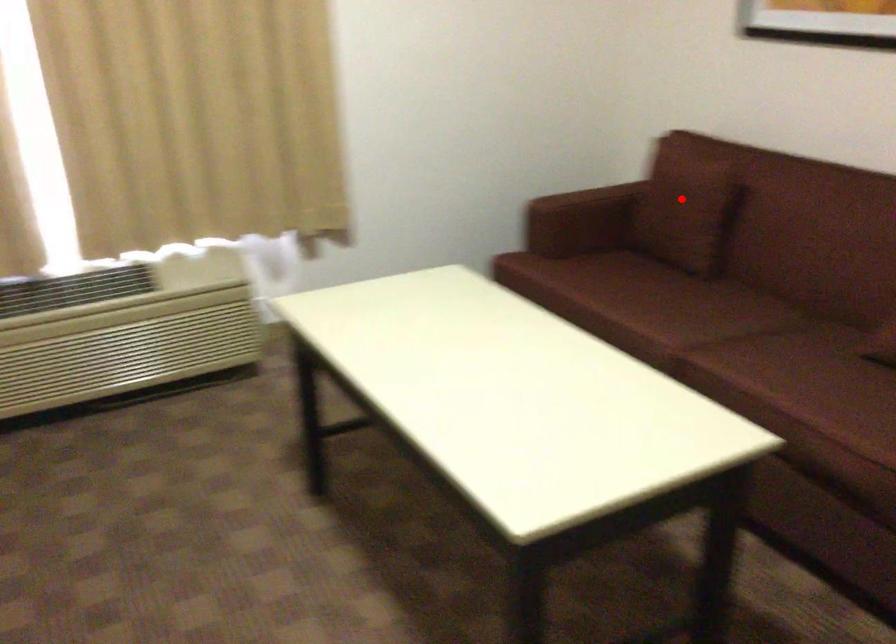
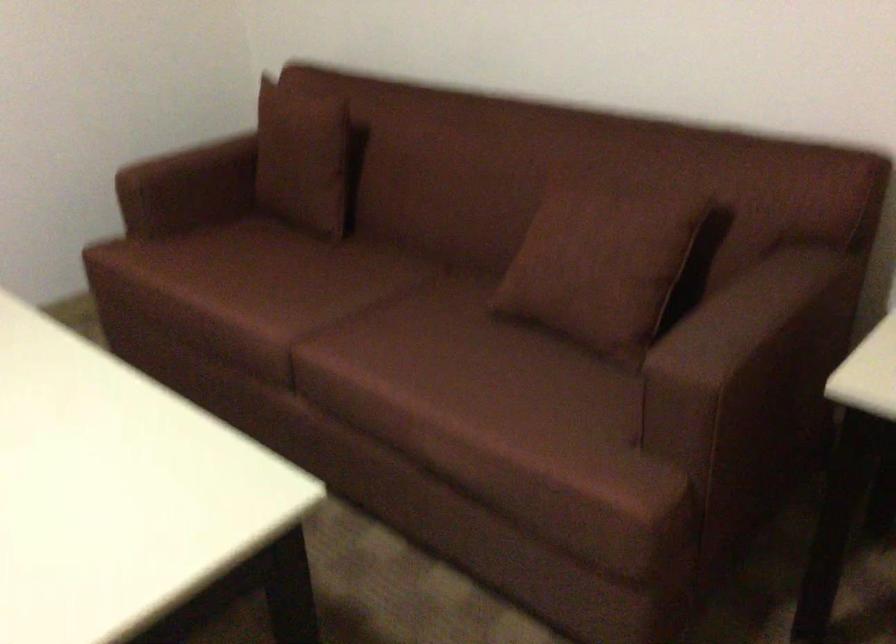
Question: I am providing you with two images of the same scene from different viewpoints. Given a red point in image1, look at the same physical point in image2. Is it:

Choices:
 (A) Closer to the viewpoint
 (B) Farther from the viewpoint

Answer: (A)